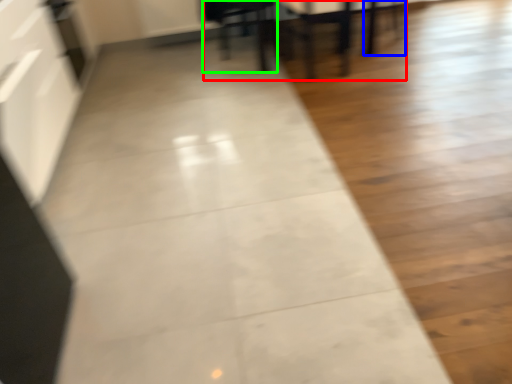
Question: Based on their relative distances, which object is nearer to table (highlighted by a red box)? Choose from chair (highlighted by a blue box) and furniture (highlighted by a green box).

Choices:
 (A) chair
 (B) furniture

Answer: (B)